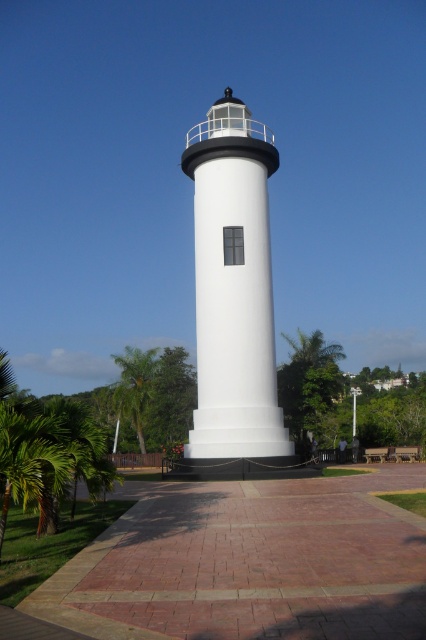
Between point (224, 413) and point (143, 404), which one is positioned behind?

Positioned behind is point (143, 404).

Is white matte/lightweight tower at center above green leafy palm tree at lower left?

Yes, white matte/lightweight tower at center is above green leafy palm tree at lower left.

What do you see at coordinates (233, 288) in the screenshot? The height and width of the screenshot is (640, 426). I see `white matte/lightweight tower at center` at bounding box center [233, 288].

Where is `white matte/lightweight tower at center`? Image resolution: width=426 pixels, height=640 pixels. white matte/lightweight tower at center is located at coordinates pyautogui.click(x=233, y=288).

Between brick paved walkway at center and green leafy palm tree at lower left, which one is positioned lower?

green leafy palm tree at lower left is lower down.

Is brick paved walkway at center shorter than green leafy palm tree at lower left?

Yes, brick paved walkway at center is shorter than green leafy palm tree at lower left.

Which is behind, point (123, 536) or point (143, 406)?

Point (143, 406)

Find the location of a particular element. brick paved walkway at center is located at coordinates (250, 563).

Is point (170, 570) positioned behind point (216, 422)?

No, (170, 570) is closer to viewer.

Is brick paved walkway at center above white matte/lightweight tower at center?

Incorrect, brick paved walkway at center is not positioned above white matte/lightweight tower at center.

Is point (221, 627) more distant than point (279, 448)?

No, (221, 627) is in front of (279, 448).

The height and width of the screenshot is (640, 426). Find the location of `brick paved walkway at center`. brick paved walkway at center is located at coordinates (250, 563).